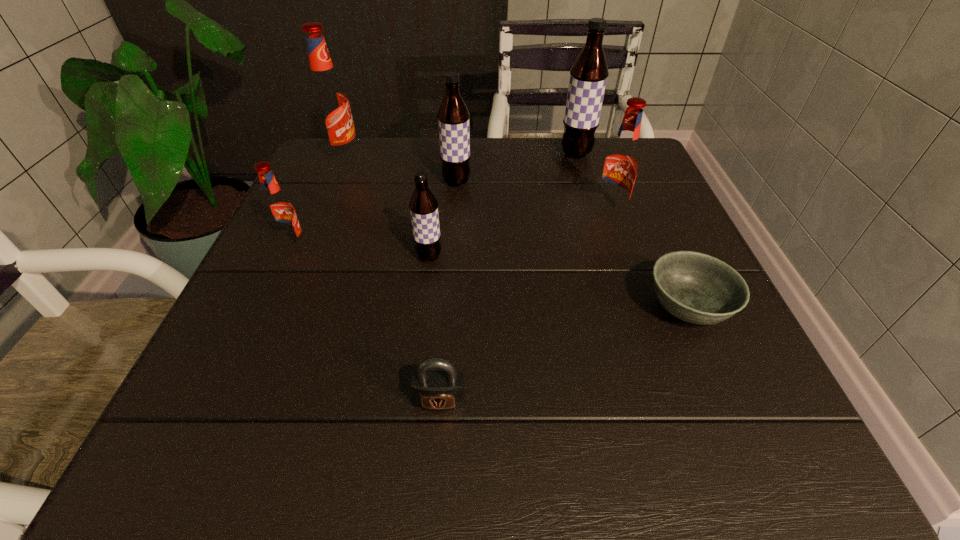
Locate an element on the screen. This screenshot has width=960, height=540. the rightmost brown root beer is located at coordinates (588, 76).

Identify the location of the farthest brown root beer. (588, 76).

At what (x,y) coordinates should I click in order to perform the action: click on the farthest red root beer. Please return your answer as a coordinate pair (x, y). The image size is (960, 540). Looking at the image, I should click on (329, 101).

Locate an element on the screen. The width and height of the screenshot is (960, 540). the second smallest red root beer is located at coordinates (621, 163).

The image size is (960, 540). I want to click on the fourth farthest root beer, so click(x=621, y=163).

This screenshot has width=960, height=540. What are the coordinates of `the sixth nearest object` in the screenshot? It's located at (453, 116).

The image size is (960, 540). What are the coordinates of `the third farthest root beer` in the screenshot? It's located at (453, 116).

Find the location of a particular element. the smallest red root beer is located at coordinates (279, 211).

Identify the location of the smallest brown root beer. (423, 205).

Identify the location of gray padlock. This screenshot has height=540, width=960. (436, 385).